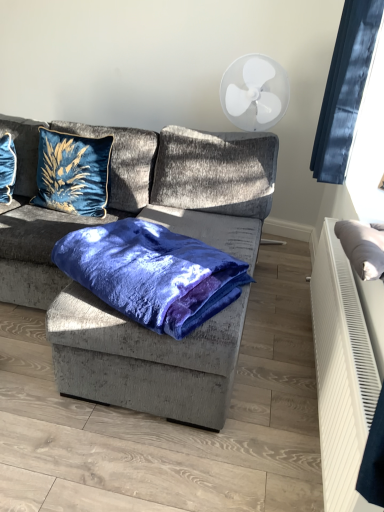
Question: Is velvet blue pillow at upper left, the 2th pillow from the back, inside or outside of velvet blue pillow at upper left, which is counted as the 3th pillow, starting from the front?

Choices:
 (A) inside
 (B) outside

Answer: (B)

Question: Is velvet blue pillow at upper left, the 2th pillow from the back, bigger or smaller than velvet blue pillow at upper left, which is counted as the 3th pillow, starting from the front?

Choices:
 (A) small
 (B) big

Answer: (B)

Question: Estimate the real-world distances between objects in this image. Which object is farther from the gray fabric pillow at right, which ranks as the 1th pillow in front-to-back order?

Choices:
 (A) velvet blue pillow at upper left, which is counted as the 3th pillow, starting from the front
 (B) velvet blue blanket at center
 (C) velvet blue pillow at upper left, the 2th pillow from the back
 (D) black fabric at upper right
 (E) velvet grey couch at center

Answer: (A)

Question: Estimate the real-world distances between objects in this image. Which object is farther from the velvet grey couch at center?

Choices:
 (A) velvet blue blanket at center
 (B) black fabric at upper right
 (C) gray fabric pillow at right, which appears as the third pillow when viewed from the back
 (D) velvet blue pillow at upper left, the 2th pillow from the back
 (E) velvet blue pillow at upper left, positioned as the 1th pillow in back-to-front order

Answer: (C)